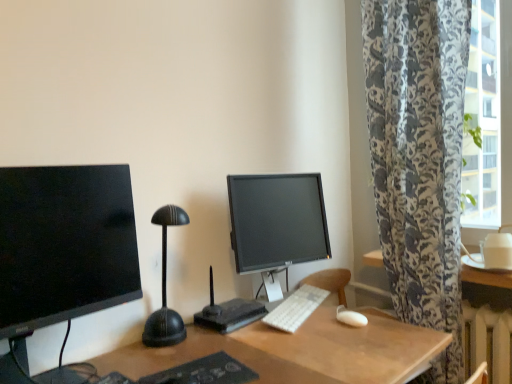
Question: From the image's perspective, is black plastic router at center beneath white plastic keyboard at center?

Choices:
 (A) no
 (B) yes

Answer: (A)

Question: Can you confirm if black plastic router at center is taller than white plastic keyboard at center?

Choices:
 (A) no
 (B) yes

Answer: (B)

Question: Is black plastic router at center positioned with its back to white plastic keyboard at center?

Choices:
 (A) no
 (B) yes

Answer: (A)

Question: Does black plastic router at center touch white plastic keyboard at center?

Choices:
 (A) no
 (B) yes

Answer: (A)

Question: Is black plastic router at center smaller than white plastic keyboard at center?

Choices:
 (A) yes
 (B) no

Answer: (B)

Question: From the image's perspective, is matte black monitor at left, which is the second computer monitor in back-to-front order, positioned above or below black plastic router at center?

Choices:
 (A) above
 (B) below

Answer: (A)

Question: In terms of size, does matte black monitor at left, acting as the 1th computer monitor starting from the front, appear bigger or smaller than black plastic router at center?

Choices:
 (A) big
 (B) small

Answer: (A)

Question: Which is correct: matte black monitor at left, which is the second computer monitor in back-to-front order, is inside black plastic router at center, or outside of it?

Choices:
 (A) inside
 (B) outside

Answer: (B)

Question: From a real-world perspective, is matte black monitor at left, acting as the 1th computer monitor starting from the front, positioned above or below black plastic router at center?

Choices:
 (A) below
 (B) above

Answer: (B)

Question: Does point (67, 306) appear closer or farther from the camera than point (335, 314)?

Choices:
 (A) closer
 (B) farther

Answer: (A)

Question: Is matte black monitor at left, which is the second computer monitor in back-to-front order, taller or shorter than white matte mouse at lower right?

Choices:
 (A) short
 (B) tall

Answer: (B)

Question: Is matte black monitor at left, which appears as the 1th computer monitor when viewed from the left, to the left or to the right of white matte mouse at lower right in the image?

Choices:
 (A) right
 (B) left

Answer: (B)

Question: From the image's perspective, is matte black monitor at left, acting as the 1th computer monitor starting from the front, located above or below white matte mouse at lower right?

Choices:
 (A) above
 (B) below

Answer: (A)

Question: In terms of size, does white matte mouse at lower right appear bigger or smaller than matte black monitor at left, acting as the 1th computer monitor starting from the front?

Choices:
 (A) small
 (B) big

Answer: (A)

Question: From a real-world perspective, is white matte mouse at lower right physically located above or below matte black monitor at left, acting as the 1th computer monitor starting from the front?

Choices:
 (A) above
 (B) below

Answer: (B)